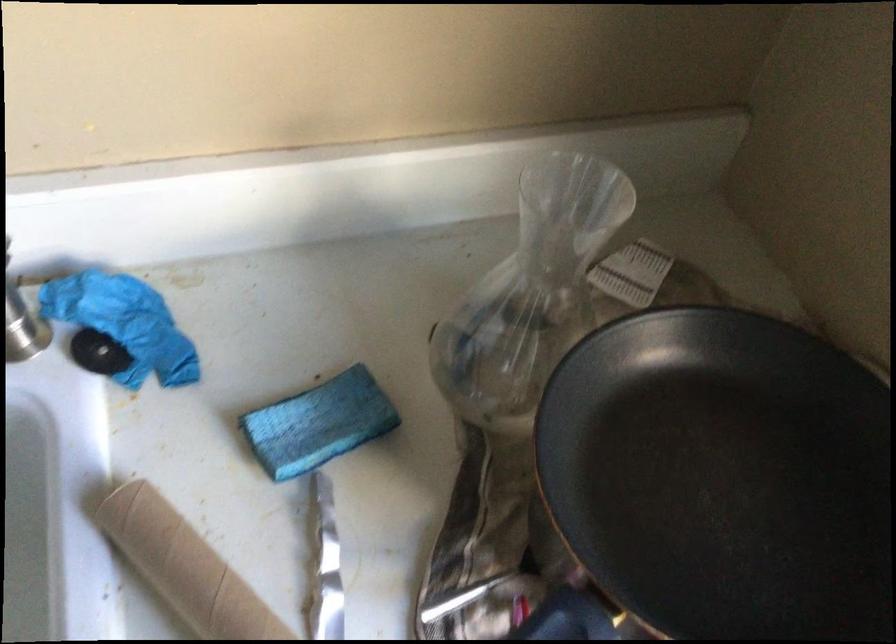
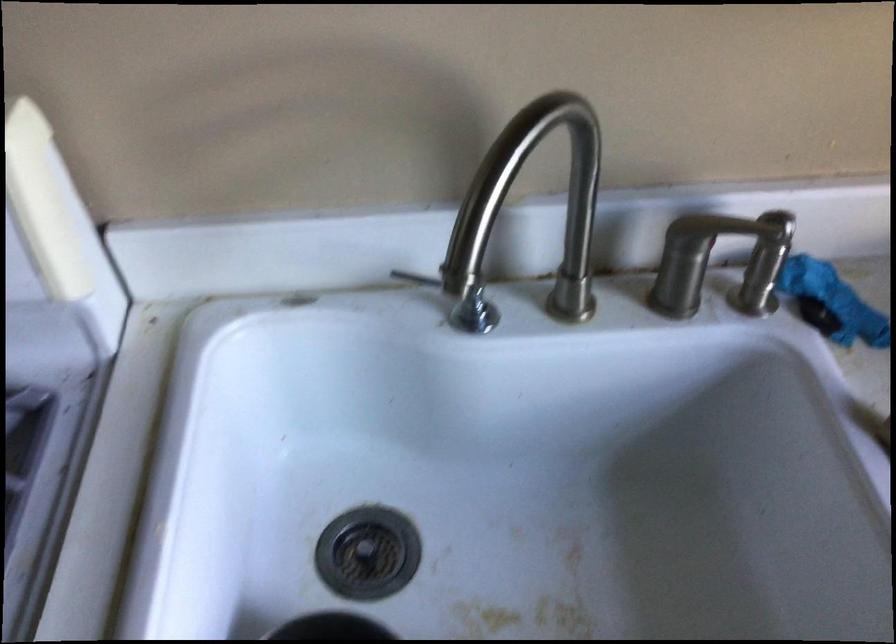
Which direction would the cameraman need to move to produce the second image?

The cameraman walked toward left, backward.